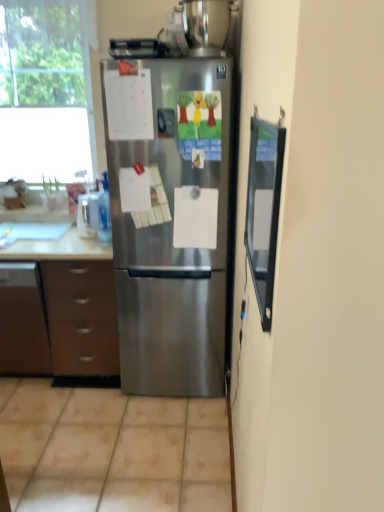
Where is `blank space situated above beige tile at lower center (from a real-world perspective)`? The width and height of the screenshot is (384, 512). blank space situated above beige tile at lower center (from a real-world perspective) is located at coordinates (96, 429).